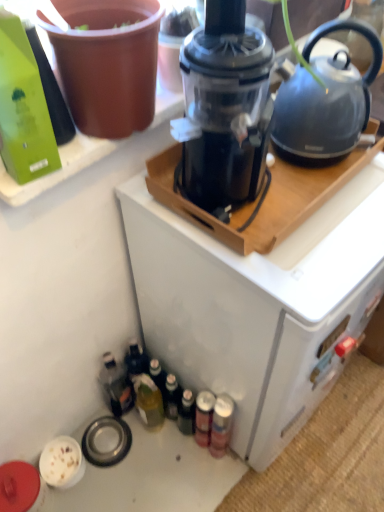
What is the approximate height of black plastic blender at center?

It is 15.33 inches.

You are a GUI agent. You are given a task and a screenshot of the screen. Output one action in this format:
    pyautogui.click(x=<x>, y=<y>)
    Task: Click on the matte gray kettle at upper right
    
    Given the screenshot: What is the action you would take?
    pyautogui.click(x=325, y=102)

Can matte gray kettle at upper right be found inside translucent plastic bottle at lower left, arranged as the 2th bottle when ordered from the bottom?

No, matte gray kettle at upper right is not surrounded by translucent plastic bottle at lower left, arranged as the 2th bottle when ordered from the bottom.

Does point (105, 387) come farther from viewer compared to point (310, 121)?

Yes.

From the matte gray kettle at upper right, count the 2nd bottle to the left and point to it. Please provide its 2D coordinates.

[(116, 384)]

In the scene shown: Is the surface of translucent plastic bottle at lower left, which appears as the first bottle when viewed from the back, in direct contact with matte gray kettle at upper right?

They are not placed beside each other.

Based on the photo, can matte gray kettle at upper right be found inside translucent glass bottle at lower left, which ranks as the first bottle in bottom-to-top order?

No, matte gray kettle at upper right is not inside translucent glass bottle at lower left, which ranks as the first bottle in bottom-to-top order.

Is translucent glass bottle at lower left, the 3th bottle in the top-to-bottom sequence, to the left of matte gray kettle at upper right from the viewer's perspective?

Yes.

Can you confirm if translucent glass bottle at lower left, the 3th bottle in the top-to-bottom sequence, is taller than matte gray kettle at upper right?

Yes, translucent glass bottle at lower left, the 3th bottle in the top-to-bottom sequence, is taller than matte gray kettle at upper right.

From the image's perspective, between translucent glass bottle at lower left, the 3th bottle in the top-to-bottom sequence, and matte gray kettle at upper right, who is located below?

translucent glass bottle at lower left, the 3th bottle in the top-to-bottom sequence.

Are black plastic blender at center and green matte bottle at upper left, which appears as the first bottle when viewed from the front, located far from each other?

No, black plastic blender at center is in close proximity to green matte bottle at upper left, which appears as the first bottle when viewed from the front.

Can you confirm if black plastic blender at center is shorter than green matte bottle at upper left, which appears as the first bottle when viewed from the front?

No.

From the image's perspective, between black plastic blender at center and green matte bottle at upper left, which appears as the first bottle when viewed from the front, who is located below?

black plastic blender at center, from the image's perspective.

Which is behind, point (202, 54) or point (44, 57)?

The point (44, 57) is more distant.

Considering the relative sizes of black plastic blender at center and translucent plastic bottle at lower left, arranged as the 2th bottle when ordered from the bottom, in the image provided, is black plastic blender at center smaller than translucent plastic bottle at lower left, arranged as the 2th bottle when ordered from the bottom,?

No.

Considering the points (243, 66) and (128, 384), which point is behind, point (243, 66) or point (128, 384)?

Point (128, 384)

Is black plastic blender at center in front of translucent plastic bottle at lower left, which appears as the first bottle when viewed from the back?

That is True.

Which object is further away from the camera taking this photo, matte gray kettle at upper right or green matte bottle at upper left, which appears as the first bottle when viewed from the front?

matte gray kettle at upper right is behind.

Considering the relative positions of matte gray kettle at upper right and green matte bottle at upper left, the first bottle in the top-to-bottom sequence, in the image provided, is matte gray kettle at upper right to the left of green matte bottle at upper left, the first bottle in the top-to-bottom sequence, from the viewer's perspective?

No.

At what (x,y) coordinates should I click in order to perform the action: click on the 1st bottle below the matte gray kettle at upper right (from the image's perspective). Please return your answer as a coordinate pair (x, y). This screenshot has width=384, height=512. Looking at the image, I should click on (51, 90).

Is matte gray kettle at upper right aimed at green matte bottle at upper left, the first bottle in the top-to-bottom sequence?

No, matte gray kettle at upper right is not oriented towards green matte bottle at upper left, the first bottle in the top-to-bottom sequence.

Between translucent plastic bottle at lower left, which is the third bottle in front-to-back order, and translucent glass bottle at lower left, which is counted as the second bottle, starting from the front, which one has less height?

translucent glass bottle at lower left, which is counted as the second bottle, starting from the front, is shorter.

From a real-world perspective, is translucent plastic bottle at lower left, which appears as the first bottle when viewed from the back, beneath translucent glass bottle at lower left, the 3th bottle in the top-to-bottom sequence?

Indeed, from a real-world perspective, translucent plastic bottle at lower left, which appears as the first bottle when viewed from the back, is positioned beneath translucent glass bottle at lower left, the 3th bottle in the top-to-bottom sequence.

Is translucent plastic bottle at lower left, the 2th bottle when ordered from top to bottom, positioned far away from translucent glass bottle at lower left, the 3th bottle in the top-to-bottom sequence?

Actually, translucent plastic bottle at lower left, the 2th bottle when ordered from top to bottom, and translucent glass bottle at lower left, the 3th bottle in the top-to-bottom sequence, are a little close together.

From the picture: From the image's perspective, is translucent plastic bottle at lower left, which is the third bottle in front-to-back order, below translucent glass bottle at lower left, which is counted as the second bottle, starting from the front?

Incorrect, from the image's perspective, translucent plastic bottle at lower left, which is the third bottle in front-to-back order, is higher than translucent glass bottle at lower left, which is counted as the second bottle, starting from the front.

Could black plastic blender at center be considered to be inside green matte bottle at upper left, the first bottle in the top-to-bottom sequence?

No, black plastic blender at center is not surrounded by green matte bottle at upper left, the first bottle in the top-to-bottom sequence.

Where is `blender below the green matte bottle at upper left, the third bottle positioned from the back (from the image's perspective)`? blender below the green matte bottle at upper left, the third bottle positioned from the back (from the image's perspective) is located at coordinates (225, 106).

Which is more to the right, green matte bottle at upper left, which appears as the first bottle when viewed from the front, or black plastic blender at center?

Positioned to the right is black plastic blender at center.

From a real-world perspective, is green matte bottle at upper left, the third bottle positioned from the back, on top of black plastic blender at center?

Yes, from a real-world perspective, green matte bottle at upper left, the third bottle positioned from the back, is above black plastic blender at center.

Where is `kettle above the translucent plastic bottle at lower left, which appears as the first bottle when viewed from the back (from the image's perspective)`? kettle above the translucent plastic bottle at lower left, which appears as the first bottle when viewed from the back (from the image's perspective) is located at coordinates (325, 102).

You are a GUI agent. You are given a task and a screenshot of the screen. Output one action in this format:
    pyautogui.click(x=<x>, y=<y>)
    Task: Click on the bottle that is the 3rd object located below the matte gray kettle at upper right (from the image's perspective)
    The image size is (384, 512).
    Given the screenshot: What is the action you would take?
    coord(148,400)

Looking at the image, which one is located closer to translucent plastic bottle at lower left, the 2th bottle when ordered from top to bottom, matte gray kettle at upper right or green matte bottle at upper left, the first bottle in the top-to-bottom sequence?

green matte bottle at upper left, the first bottle in the top-to-bottom sequence.

Looking at the image, which one is located closer to translucent glass bottle at lower left, which is counted as the 2th bottle, starting from the back, green matte bottle at upper left, the third bottle positioned from the back, or translucent plastic bottle at lower left, arranged as the 2th bottle when ordered from the bottom?

Based on the image, translucent plastic bottle at lower left, arranged as the 2th bottle when ordered from the bottom, appears to be nearer to translucent glass bottle at lower left, which is counted as the 2th bottle, starting from the back.

From the image, which object appears to be nearer to black plastic blender at center, green matte bottle at upper left, the third bottle positioned from the back, or translucent glass bottle at lower left, the 3th bottle in the top-to-bottom sequence?

Based on the image, green matte bottle at upper left, the third bottle positioned from the back, appears to be nearer to black plastic blender at center.

When comparing their distances from translucent plastic bottle at lower left, the 2th bottle when ordered from top to bottom, does green matte bottle at upper left, the third bottle when ordered from bottom to top, or black plastic blender at center seem further?

The object further to translucent plastic bottle at lower left, the 2th bottle when ordered from top to bottom, is green matte bottle at upper left, the third bottle when ordered from bottom to top.

From the image, which object appears to be nearer to matte gray kettle at upper right, translucent plastic bottle at lower left, arranged as the 2th bottle when ordered from the bottom, or black plastic blender at center?

black plastic blender at center is positioned closer to the anchor matte gray kettle at upper right.

Looking at the image, which one is located further to green matte bottle at upper left, the third bottle positioned from the back, translucent plastic bottle at lower left, which appears as the first bottle when viewed from the back, or matte gray kettle at upper right?

Among the two, translucent plastic bottle at lower left, which appears as the first bottle when viewed from the back, is located further to green matte bottle at upper left, the third bottle positioned from the back.

Estimate the real-world distances between objects in this image. Which object is closer to translucent glass bottle at lower left, which ranks as the first bottle in bottom-to-top order, matte gray kettle at upper right or green matte bottle at upper left, which appears as the first bottle when viewed from the front?

green matte bottle at upper left, which appears as the first bottle when viewed from the front, is closer to translucent glass bottle at lower left, which ranks as the first bottle in bottom-to-top order.

From the image, which object appears to be nearer to matte gray kettle at upper right, translucent plastic bottle at lower left, which is the third bottle in front-to-back order, or translucent glass bottle at lower left, which is counted as the 2th bottle, starting from the back?

translucent glass bottle at lower left, which is counted as the 2th bottle, starting from the back, is closer to matte gray kettle at upper right.

Find the location of a particular element. The width and height of the screenshot is (384, 512). bottle between black plastic blender at center and translucent glass bottle at lower left, which is counted as the 2th bottle, starting from the back, in the vertical direction is located at coordinates (116, 384).

I want to click on blender between matte gray kettle at upper right and translucent plastic bottle at lower left, the 2th bottle when ordered from top to bottom, from top to bottom, so click(x=225, y=106).

Locate an element on the screen. This screenshot has height=512, width=384. blender between green matte bottle at upper left, the first bottle in the top-to-bottom sequence, and translucent glass bottle at lower left, which is counted as the second bottle, starting from the front, in the up-down direction is located at coordinates (225, 106).

Locate an element on the screen. Image resolution: width=384 pixels, height=512 pixels. bottle between green matte bottle at upper left, which appears as the first bottle when viewed from the front, and translucent glass bottle at lower left, which is counted as the second bottle, starting from the front, vertically is located at coordinates (116, 384).